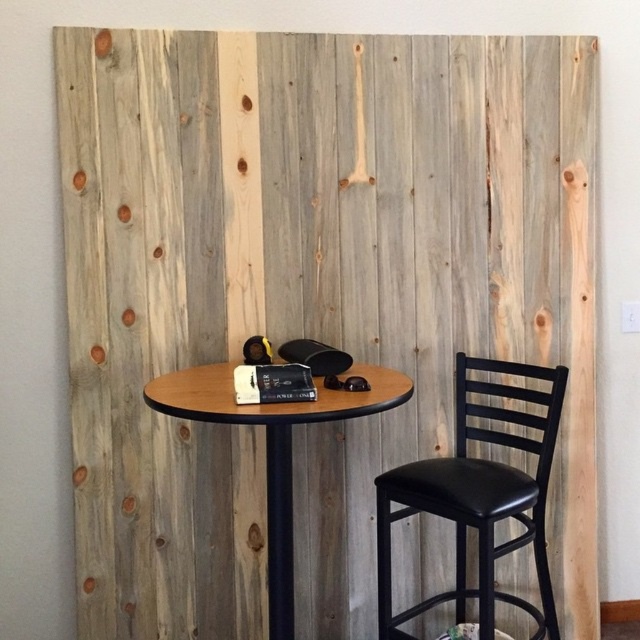
Is black leather chair at right wider than wooden round table at center?

Incorrect, black leather chair at right's width does not surpass wooden round table at center's.

Is point (390, 604) farther from camera compared to point (384, 392)?

Yes.

Describe the element at coordinates (477, 497) in the screenshot. I see `black leather chair at right` at that location.

The image size is (640, 640). Identify the location of black leather chair at right. pyautogui.click(x=477, y=497).